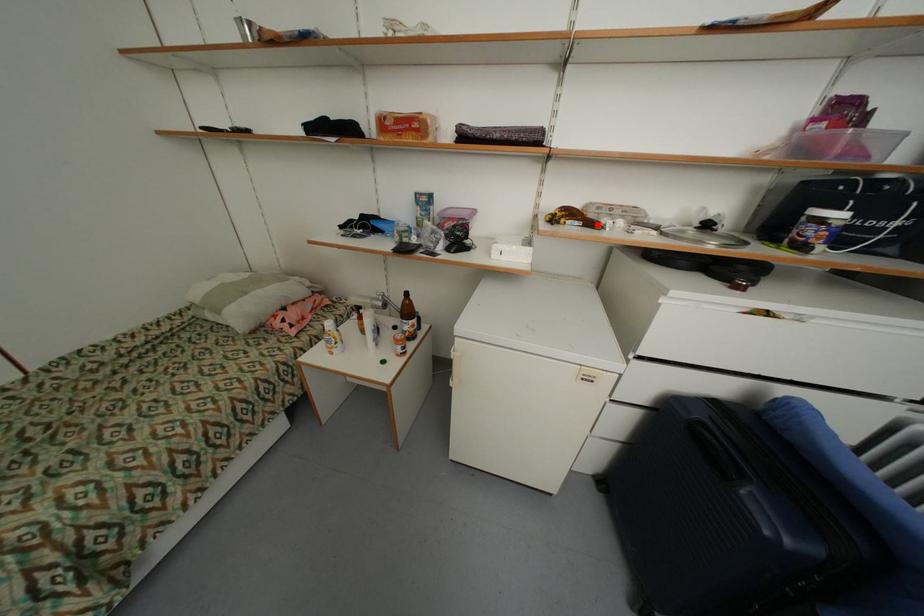
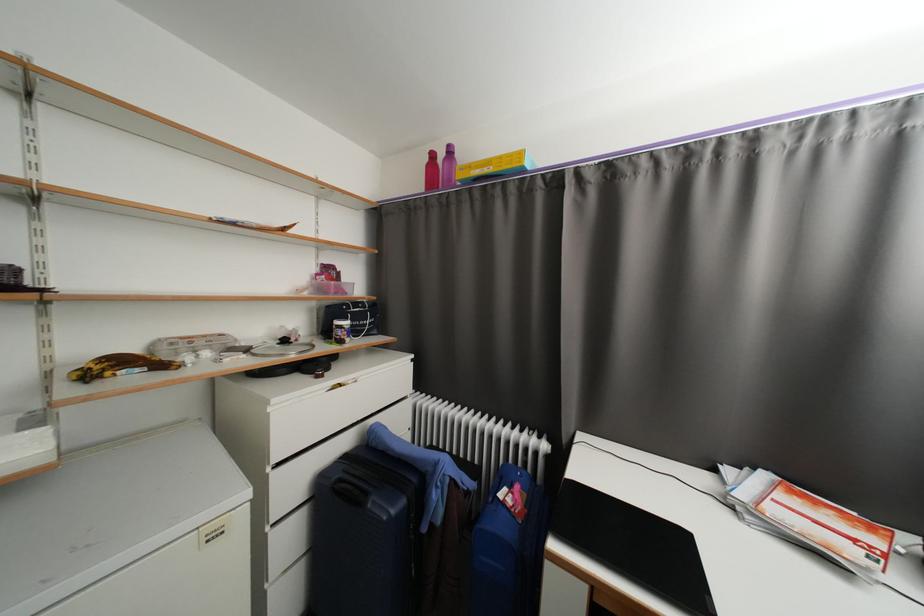
The point at the highlighted location is marked in the first image. Where is the corresponding point in the second image?

(167, 367)